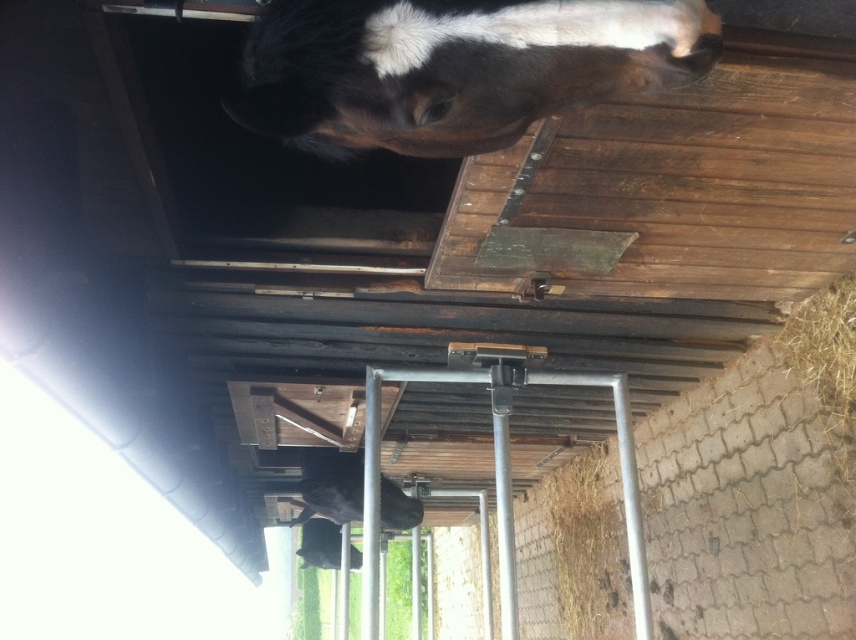
Question: Which point is closer to the camera?

Choices:
 (A) black glossy horse at center
 (B) black and white fur horse at upper center

Answer: (B)

Question: Which of the following is the closest to the observer?

Choices:
 (A) black glossy horse at center
 (B) black and white fur horse at upper center

Answer: (B)

Question: Is black and white fur horse at upper center to the left of black glossy horse at center from the viewer's perspective?

Choices:
 (A) no
 (B) yes

Answer: (A)

Question: Is black and white fur horse at upper center smaller than black glossy horse at center?

Choices:
 (A) no
 (B) yes

Answer: (B)

Question: Among these objects, which one is farthest from the camera?

Choices:
 (A) black glossy horse at center
 (B) black and white fur horse at upper center

Answer: (A)

Question: Can you confirm if black and white fur horse at upper center is wider than black glossy horse at center?

Choices:
 (A) no
 (B) yes

Answer: (A)